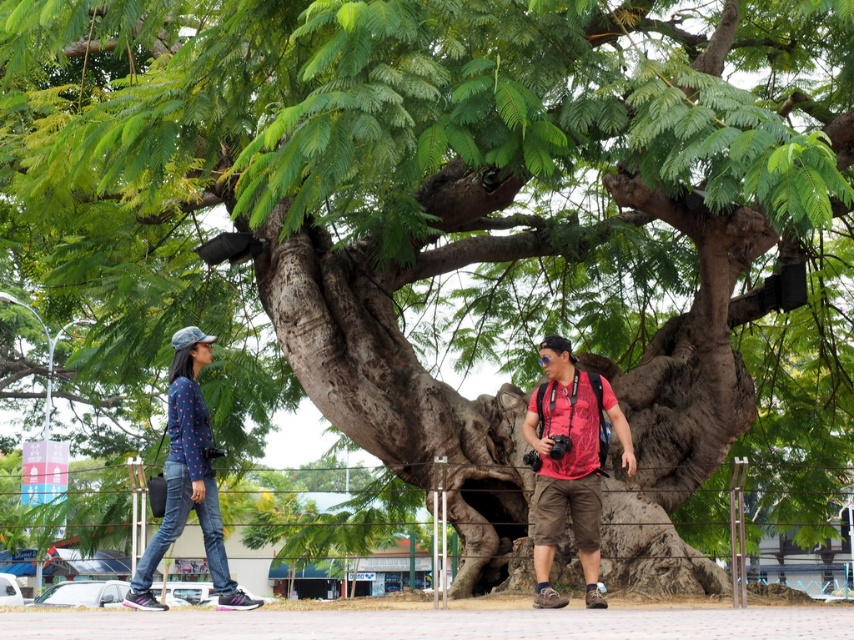
You are a photographer positioned at the center of the walkway. You want to take a photo of the matte red shirt at center and denim jeans at left. Which object should you zoom in on to capture more details without moving your camera?

The matte red shirt at center has a lesser width compared to denim jeans at left, so you should zoom in on the matte red shirt at center to capture more details since it is smaller in size.

You are a photographer trying to capture a candid shot of the two people on the walkway. The person wearing the matte red shirt at center and the one in denim jeans at left are walking away from you. To ensure both are in frame, should you position your camera to the left or right of the walkway?

The matte red shirt at center is positioned on the right side of denim jeans at left. To include both in the frame, position the camera to the left of the walkway so you can capture the denim jeans at left on the left side and the matte red shirt at center on the right side of the frame.